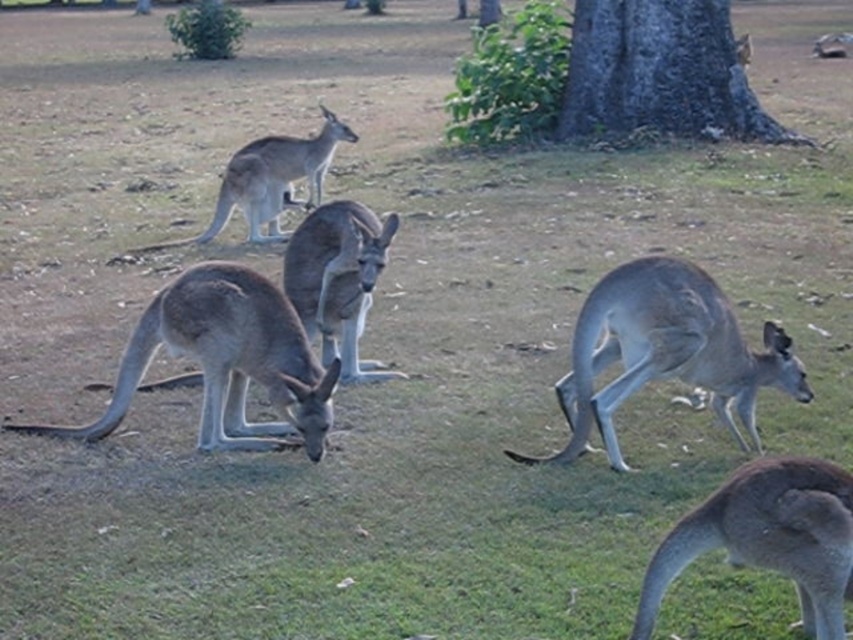
Question: From the image, what is the correct spatial relationship of brown rough bark tree at upper center in relation to gray matte kangaroo at upper center?

Choices:
 (A) above
 (B) below

Answer: (A)

Question: Can you confirm if brown rough bark tree at upper center is thinner than gray matte kangaroo at upper center?

Choices:
 (A) no
 (B) yes

Answer: (A)

Question: Which object appears farthest from the camera in this image?

Choices:
 (A) brown fur kangaroo at center
 (B) brown rough bark tree at upper center

Answer: (B)

Question: Which object is farther from the camera taking this photo?

Choices:
 (A) gray matte kangaroo at lower left
 (B) gray matte kangaroo at center

Answer: (B)

Question: Is gray matte kangaroo at center positioned before brown fur kangaroo at center?

Choices:
 (A) yes
 (B) no

Answer: (A)

Question: Which is nearer to the brown rough bark tree at upper center?

Choices:
 (A) brown fur at lower right
 (B) brown fur kangaroo at center
 (C) gray matte kangaroo at lower left
 (D) gray matte kangaroo at center

Answer: (B)